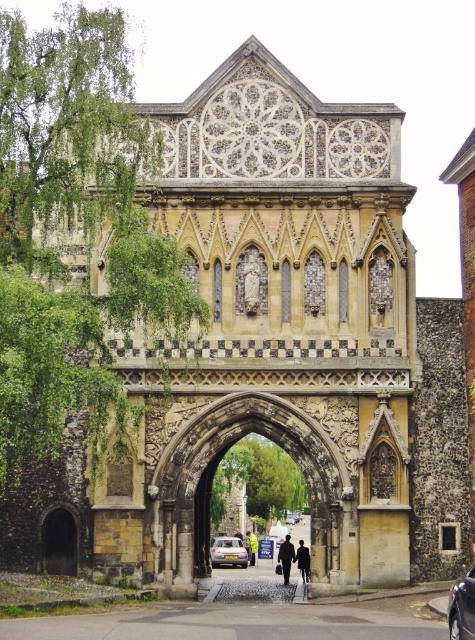
Does metallic silver car at center have a larger size compared to silver metallic car at center?

Indeed, metallic silver car at center has a larger size compared to silver metallic car at center.

Does metallic silver car at center have a smaller size compared to silver metallic car at center?

No, metallic silver car at center is not smaller than silver metallic car at center.

Which is in front, point (465, 573) or point (222, 548)?

Point (465, 573)

This screenshot has height=640, width=475. I want to click on metallic silver car at center, so click(x=462, y=608).

Is silver metallic car at center closer to the viewer compared to dark blue fabric coat at center?

No, silver metallic car at center is behind dark blue fabric coat at center.

Which is more to the right, silver metallic car at center or dark blue fabric coat at center?

dark blue fabric coat at center

At what (x,y) coordinates should I click in order to perform the action: click on silver metallic car at center. Please return your answer as a coordinate pair (x, y). Image resolution: width=475 pixels, height=640 pixels. Looking at the image, I should click on (228, 552).

Identify the location of silver metallic car at center. (228, 552).

Does point (207, 474) lie in front of point (252, 538)?

Yes.

Can you confirm if stone textured archway at center is taller than black fabric person at center?

Yes.

This screenshot has height=640, width=475. What do you see at coordinates (214, 474) in the screenshot?
I see `stone textured archway at center` at bounding box center [214, 474].

Where is `stone textured archway at center`? The height and width of the screenshot is (640, 475). stone textured archway at center is located at coordinates (214, 474).